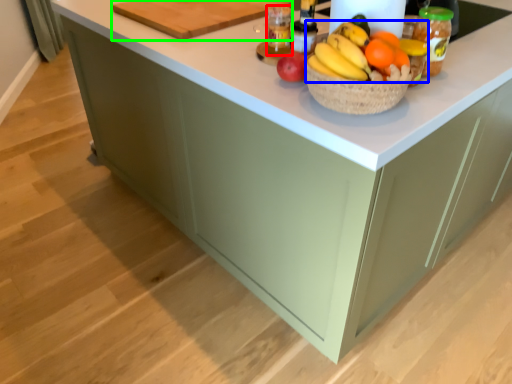
Question: Which is nearer to the bottle (highlighted by a red box)? grapefruit (highlighted by a blue box) or cutting board (highlighted by a green box).

Choices:
 (A) grapefruit
 (B) cutting board

Answer: (B)